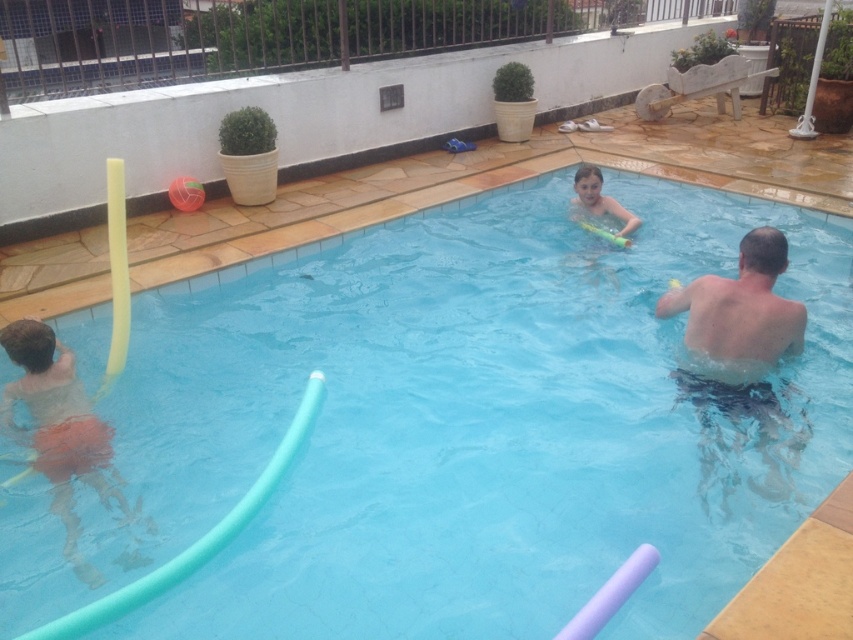
You are standing at the edge of the pool and want to reach the point closer to you between point (683, 346) and point (82, 474). Which point should you swim towards?

Point (683, 346) is further to the camera than point (82, 474), so the closer point to you is point (82, 474). You should swim towards point (82, 474).

You are standing at the center of the pool and want to reach the blue rubber pool float at lower left. Based on the coordinates provided, in which direction should you swim to get there?

The blue rubber pool float at lower left is located at coordinates point (468, 422). Since the coordinate system starts at the bottom left corner of the image, the x value of 0.662 indicates a position to the right, and the y value of 0.550 indicates a position above. Therefore, to reach the blue rubber pool float at lower left, you should swim to the right and slightly upward from the center of the pool.

You are a lifeguard observing the pool area. You notice two people in the water wearing skinny blue shorts at right and matte orange shorts at left. Based on their positions, which swimmer is closer to the edge of the pool?

The skinny blue shorts at right is positioned over matte orange shorts at left, meaning the swimmer in skinny blue shorts at right is closer to the edge of the pool.